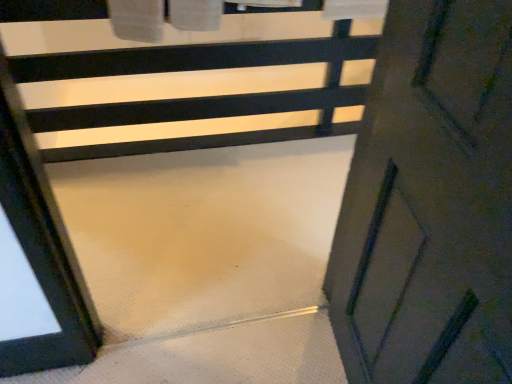
The width and height of the screenshot is (512, 384). What are the coordinates of `vacant space underneath white matte stair at center (from a real-world perspective)` in the screenshot? It's located at (216, 312).